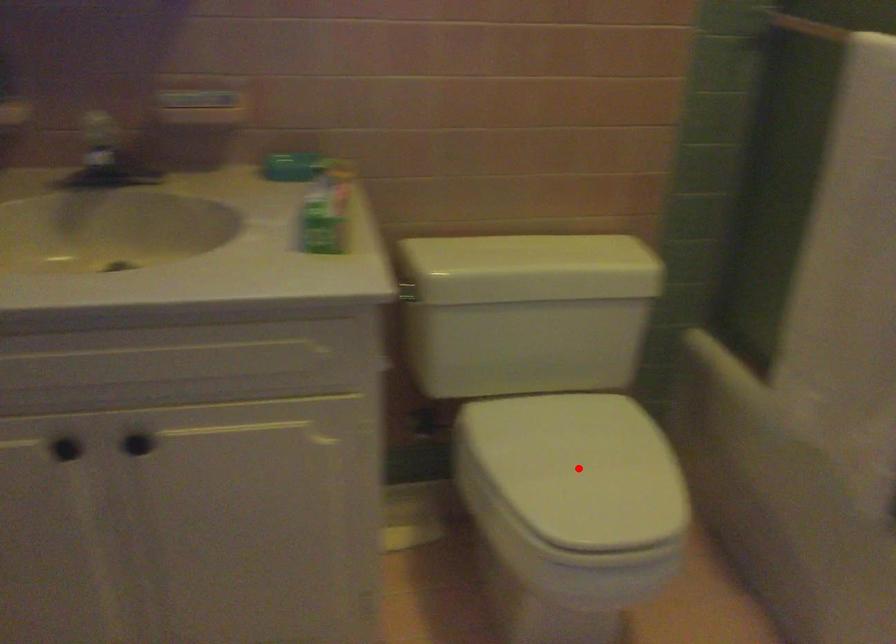
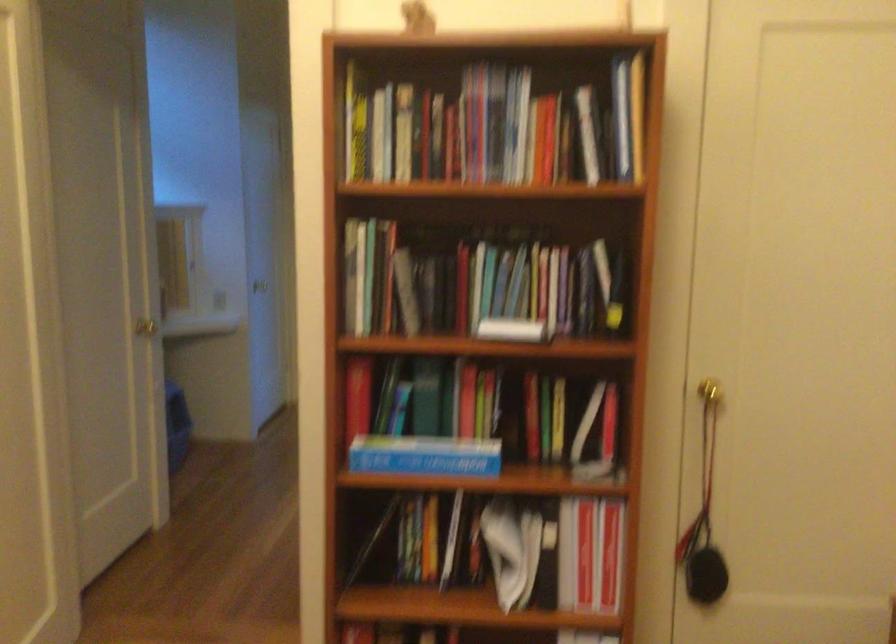
Question: I am providing you with two images of the same scene from different viewpoints. A red point is marked on the first image. Is the red point's position out of view in image 2?

Choices:
 (A) Yes
 (B) No

Answer: (A)